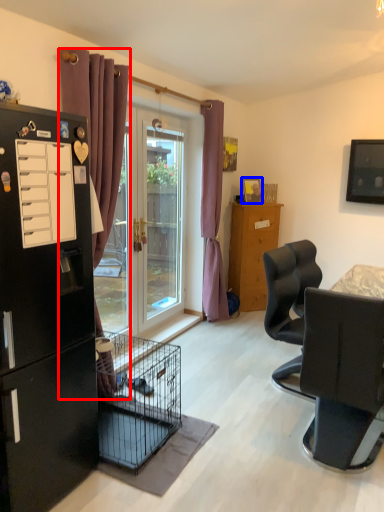
Question: Among these objects, which one is nearest to the camera, curtain (highlighted by a red box) or picture frame (highlighted by a blue box)?

Choices:
 (A) curtain
 (B) picture frame

Answer: (A)